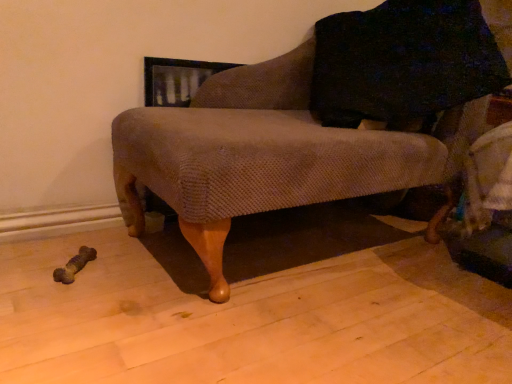
You are a GUI agent. You are given a task and a screenshot of the screen. Output one action in this format:
    pyautogui.click(x=<x>, y=<y>)
    Task: Click on the free space in front of knitted fabric chair at center
    This screenshot has height=384, width=512.
    Given the screenshot: What is the action you would take?
    pyautogui.click(x=310, y=331)